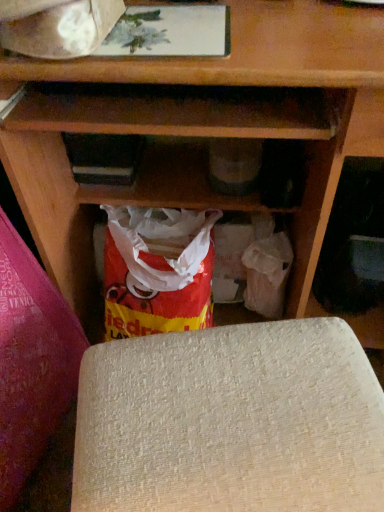
Question: Looking at the image, does white paper at upper left seem bigger or smaller compared to beige textured yoga mat at lower center, the first yoga mat positioned from the right?

Choices:
 (A) small
 (B) big

Answer: (A)

Question: Is white paper at upper left wider or thinner than beige textured yoga mat at lower center, acting as the 2th yoga mat starting from the left?

Choices:
 (A) thin
 (B) wide

Answer: (A)

Question: Estimate the real-world distances between objects in this image. Which object is closer to the matte plastic grocery bag at lower right?

Choices:
 (A) beige textured yoga mat at lower left, placed as the first yoga mat when sorted from left to right
 (B) beige textured yoga mat at lower center, the first yoga mat positioned from the right
 (C) white paper at upper left

Answer: (B)

Question: Which is farther from the white paper at upper left?

Choices:
 (A) beige textured yoga mat at lower center, acting as the 2th yoga mat starting from the left
 (B) beige textured yoga mat at lower left, placed as the first yoga mat when sorted from left to right
 (C) matte plastic grocery bag at lower right

Answer: (C)